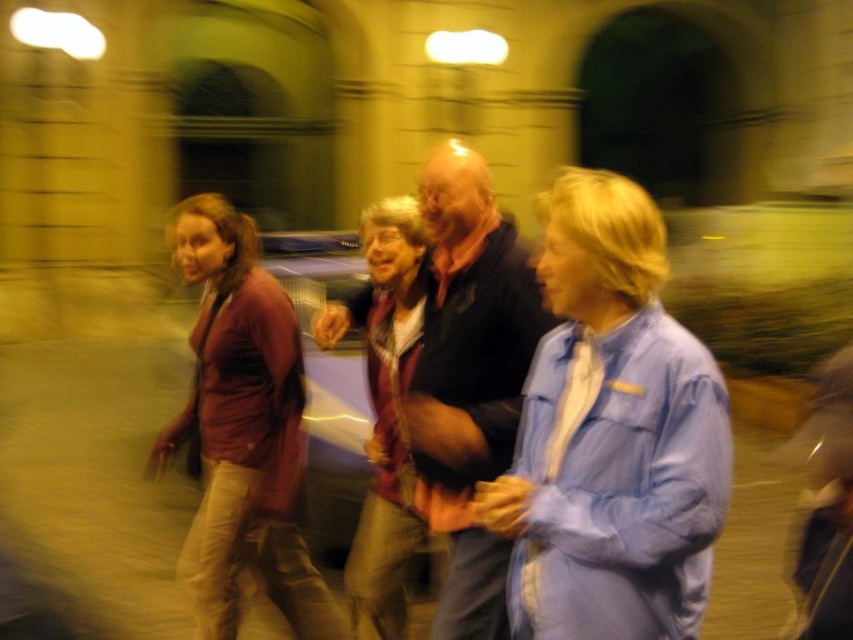
Question: Does matte blue shirt at center have a smaller size compared to matte red jacket at center?

Choices:
 (A) no
 (B) yes

Answer: (A)

Question: Considering the relative positions of matte blue shirt at center and dark blue shirt at center in the image provided, where is matte blue shirt at center located with respect to dark blue shirt at center?

Choices:
 (A) left
 (B) right

Answer: (B)

Question: Estimate the real-world distances between objects in this image. Which object is closer to the dark blue shirt at center?

Choices:
 (A) matte blue shirt at center
 (B) matte red jacket at center

Answer: (B)

Question: Does matte maroon sweater at left lie behind matte red jacket at center?

Choices:
 (A) yes
 (B) no

Answer: (A)

Question: Which point appears farthest from the camera in this image?

Choices:
 (A) (514, 394)
 (B) (267, 493)

Answer: (B)

Question: Estimate the real-world distances between objects in this image. Which object is closer to the matte blue shirt at center?

Choices:
 (A) dark blue shirt at center
 (B) matte maroon sweater at left
 (C) matte red jacket at center

Answer: (A)